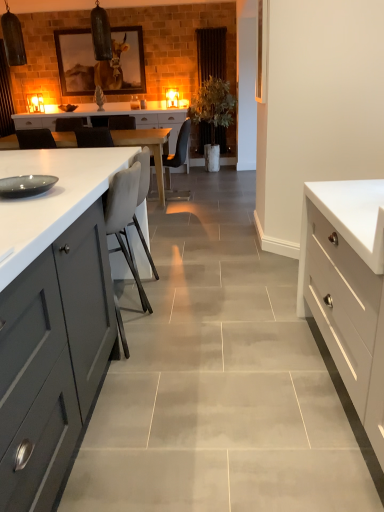
Question: Is white glossy drawer at right closer to the viewer compared to green leafy plant at center?

Choices:
 (A) no
 (B) yes

Answer: (B)

Question: Is green leafy plant at center located within white glossy drawer at right?

Choices:
 (A) yes
 (B) no

Answer: (B)

Question: Is white glossy drawer at right facing away from green leafy plant at center?

Choices:
 (A) yes
 (B) no

Answer: (B)

Question: Considering the relative sizes of white glossy drawer at right and green leafy plant at center in the image provided, is white glossy drawer at right shorter than green leafy plant at center?

Choices:
 (A) yes
 (B) no

Answer: (A)

Question: Does white glossy drawer at right appear on the right side of green leafy plant at center?

Choices:
 (A) yes
 (B) no

Answer: (A)

Question: Based on their positions, is matte black chair at center, acting as the 2th chair starting from the bottom, located to the left or right of white glossy drawer at right?

Choices:
 (A) left
 (B) right

Answer: (A)

Question: Considering their positions, is matte black chair at center, the 1th chair from the back, located in front of or behind white glossy drawer at right?

Choices:
 (A) front
 (B) behind

Answer: (B)

Question: In terms of height, does matte black chair at center, the 1th chair from the back, look taller or shorter compared to white glossy drawer at right?

Choices:
 (A) short
 (B) tall

Answer: (B)

Question: From a real-world perspective, is matte black chair at center, marked as the 1th chair in a top-to-bottom arrangement, physically located above or below white glossy drawer at right?

Choices:
 (A) below
 (B) above

Answer: (B)

Question: Is green leafy plant at center wider or thinner than wooden framed picture at upper center?

Choices:
 (A) thin
 (B) wide

Answer: (B)

Question: In the image, is green leafy plant at center on the left side or the right side of wooden framed picture at upper center?

Choices:
 (A) right
 (B) left

Answer: (A)

Question: From a real-world perspective, is green leafy plant at center physically located above or below wooden framed picture at upper center?

Choices:
 (A) below
 (B) above

Answer: (A)

Question: From the image's perspective, is green leafy plant at center positioned above or below wooden framed picture at upper center?

Choices:
 (A) below
 (B) above

Answer: (A)

Question: From the image's perspective, is matte black chair at center, the 1th chair from the back, above or below wooden framed picture at upper center?

Choices:
 (A) above
 (B) below

Answer: (B)

Question: Is matte black chair at center, the 1th chair from the back, taller or shorter than wooden framed picture at upper center?

Choices:
 (A) tall
 (B) short

Answer: (B)